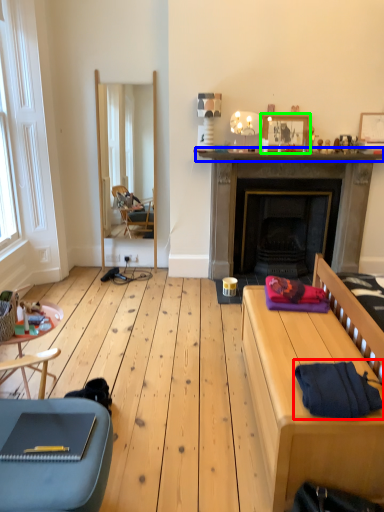
Question: Based on their relative distances, which object is nearer to clothing (highlighted by a red box)? Choose from mantle (highlighted by a blue box) and picture frame (highlighted by a green box).

Choices:
 (A) mantle
 (B) picture frame

Answer: (A)